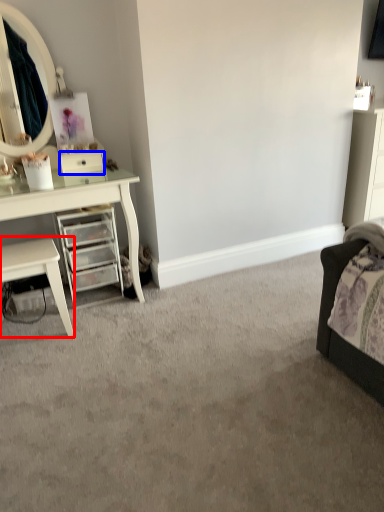
Question: Which point is closer to the camera, nightstand (highlighted by a red box) or drawer (highlighted by a blue box)?

Choices:
 (A) nightstand
 (B) drawer

Answer: (A)